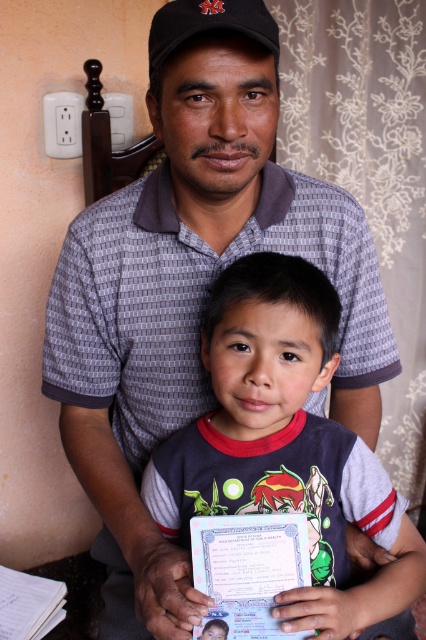
You are a drone operator trying to navigate between two points in the image. The first point is at coordinates point [250,397] and the second point is at point [169,17]. Which point is closer to you, the operator?

Point [250,397] is further to the viewer than point [169,17], so the closer point to you is point [169,17].

Where is the dark gray cotton shirt at center located in the image?

The dark gray cotton shirt at center is located at point [285,445] in the image.